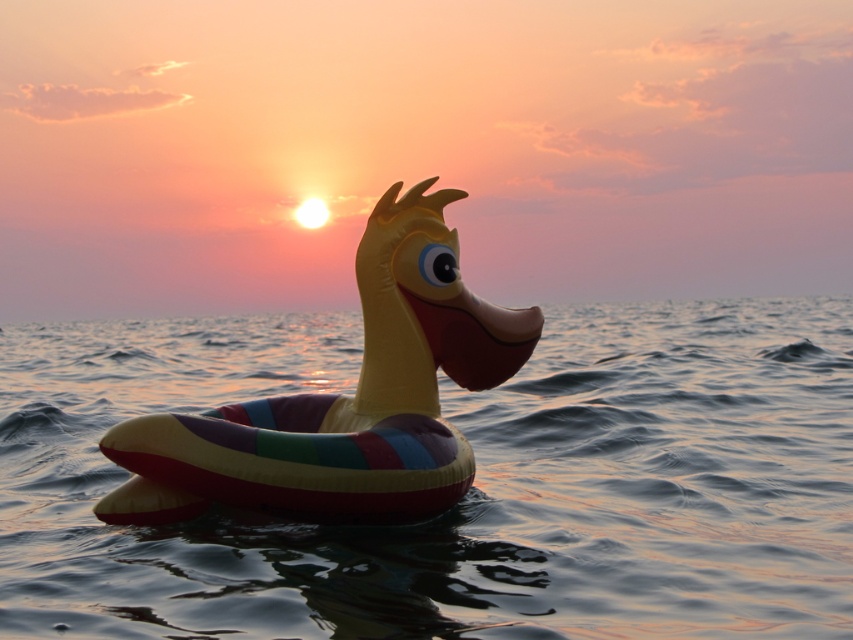
Can you confirm if translucent plastic water at center is thinner than rubber duck at center?

Incorrect, translucent plastic water at center's width is not less than rubber duck at center's.

Which is in front, point (672, 628) or point (292, 506)?

Point (672, 628)

Measure the distance between point [175,547] and camera.

The distance of point [175,547] from camera is 18.36 feet.

This screenshot has height=640, width=853. What are the coordinates of `translucent plastic water at center` in the screenshot? It's located at (469, 492).